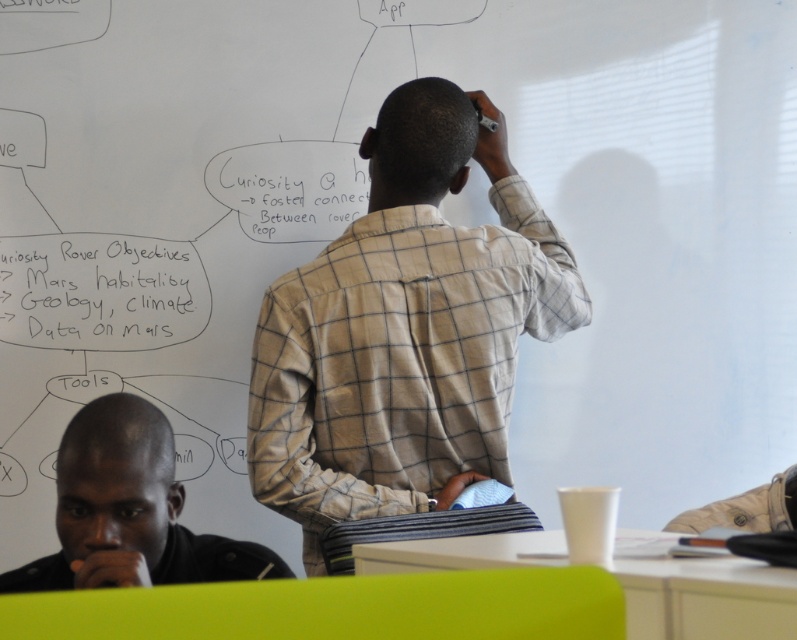
Question: Which point is closer to the camera?

Choices:
 (A) light beige checkered shirt at center
 (B) white paperboard at upper center

Answer: (A)

Question: Which point is farther to the camera?

Choices:
 (A) (359, 337)
 (B) (177, 580)
 (C) (93, 237)

Answer: (C)

Question: Is black leather jacket at lower left bigger than white paperboard at upper center?

Choices:
 (A) no
 (B) yes

Answer: (B)

Question: Can you confirm if light beige checkered shirt at center is smaller than white paperboard at upper center?

Choices:
 (A) no
 (B) yes

Answer: (A)

Question: Which object is closer to the camera taking this photo?

Choices:
 (A) black leather jacket at lower left
 (B) white paperboard at upper center
 (C) light beige checkered shirt at center

Answer: (A)

Question: Does light beige checkered shirt at center appear over white paperboard at upper center?

Choices:
 (A) no
 (B) yes

Answer: (A)